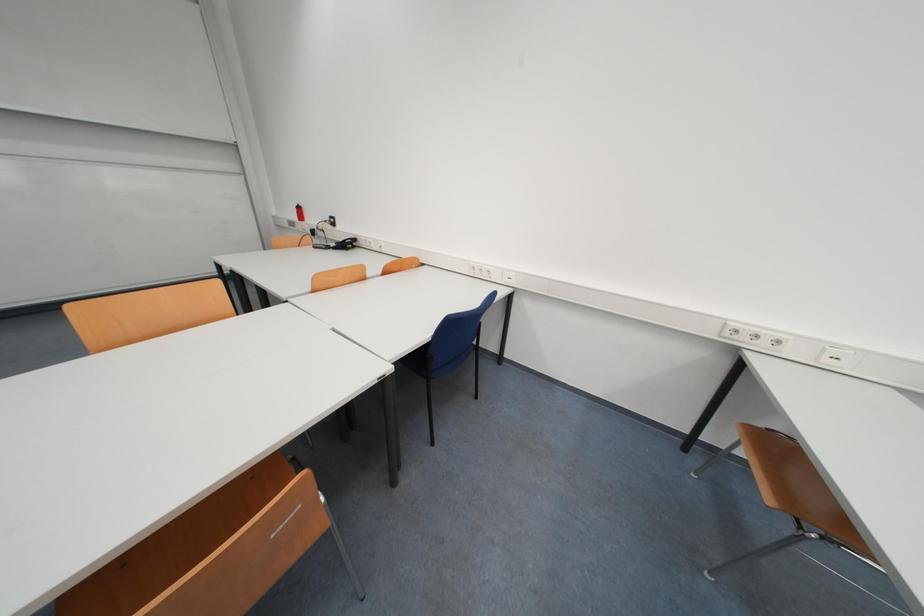
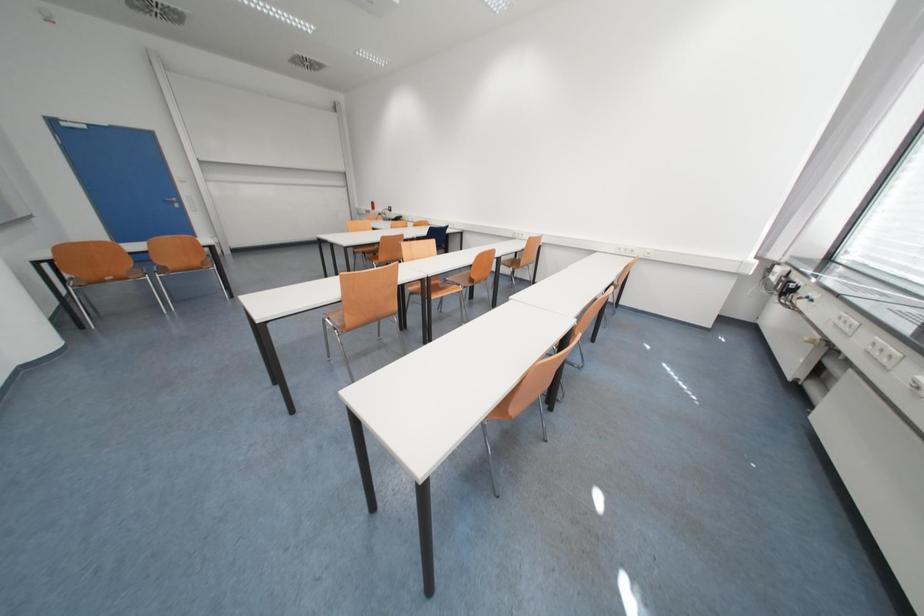
Question: In a continuous first-person perspective shot, in which direction is the camera moving?

Choices:
 (A) Left
 (B) Right
 (C) Forward
 (D) Backward

Answer: (D)